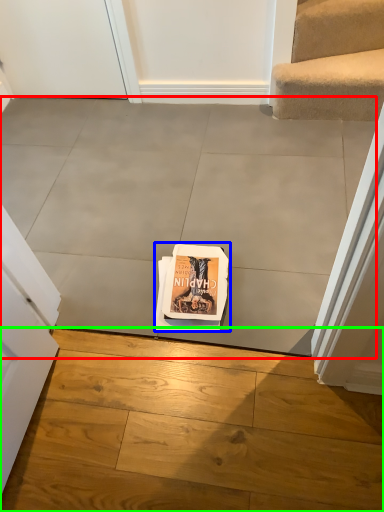
Question: Which object is the farthest from concrete (highlighted by a red box)? Choose among these: paperback book (highlighted by a blue box) or concrete (highlighted by a green box).

Choices:
 (A) paperback book
 (B) concrete

Answer: (B)